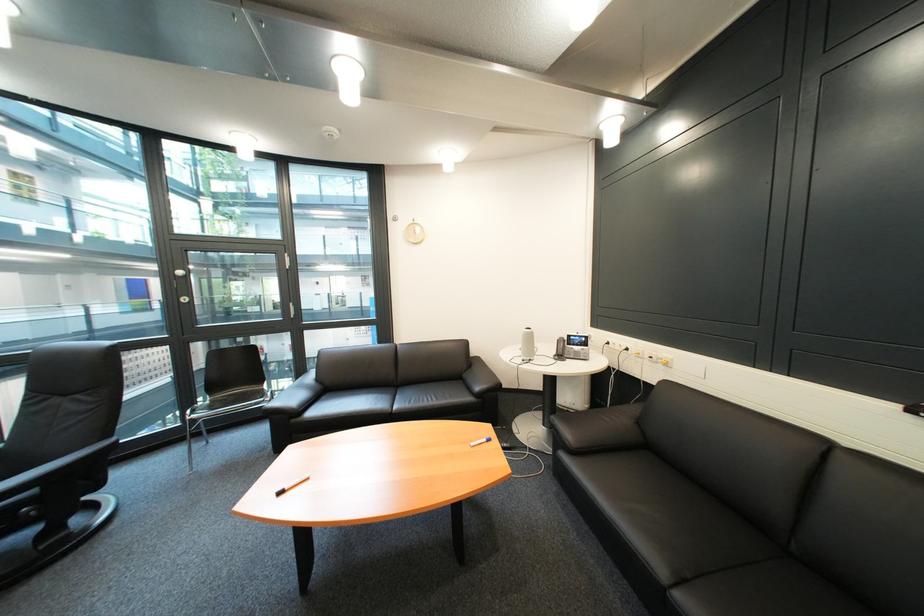
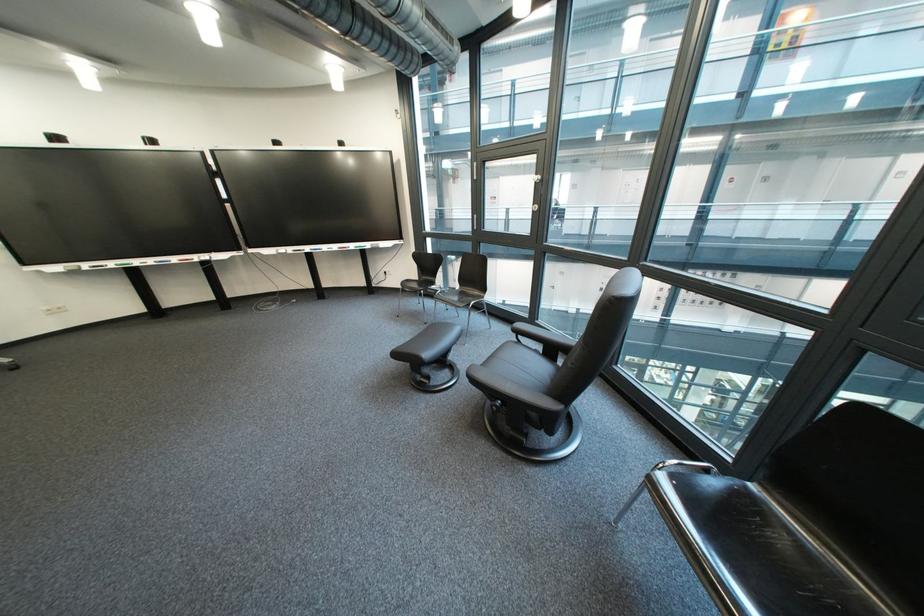
Locate, in the second image, the point that corresponds to (176,480) in the first image.

(622, 488)